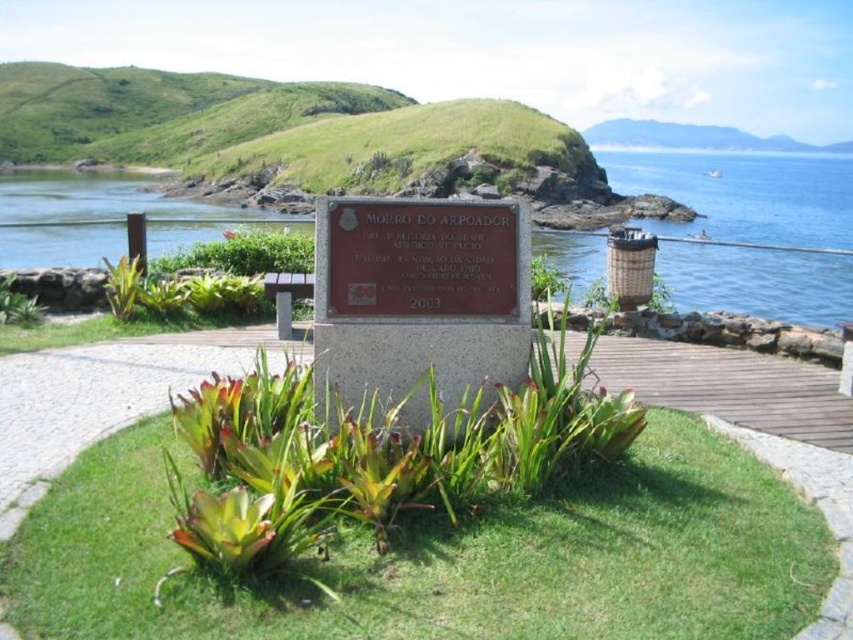
You are a gardener assessing the coastal scene. You see the green grass at center and the green leafy plant at center. Which one is shorter?

The green grass at center is shorter than the green leafy plant at center.